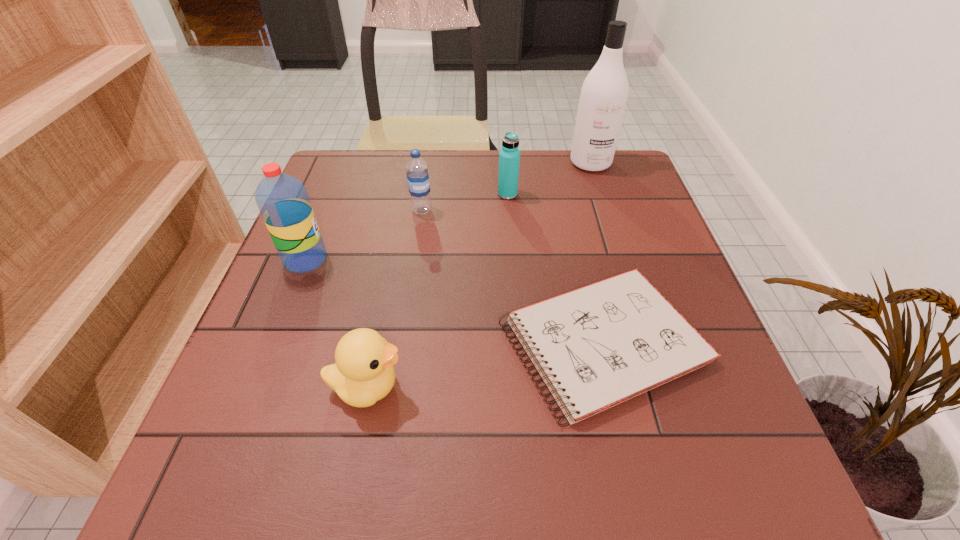
Locate an element on the screen. The height and width of the screenshot is (540, 960). vacant region between the duck and the leftmost object is located at coordinates (336, 323).

Where is `free space between the second water bottle from right to left and the rightmost water bottle`? free space between the second water bottle from right to left and the rightmost water bottle is located at coordinates (465, 202).

Find the location of a particular element. The width and height of the screenshot is (960, 540). vacant point located between the duck and the farthest object is located at coordinates (479, 275).

At what (x,y) coordinates should I click in order to perform the action: click on vacant area that lies between the shampoo and the third nearest object. Please return your answer as a coordinate pair (x, y). The width and height of the screenshot is (960, 540). Looking at the image, I should click on (448, 211).

This screenshot has width=960, height=540. I want to click on free space between the second nearest water bottle and the notepad, so click(x=513, y=276).

You are a GUI agent. You are given a task and a screenshot of the screen. Output one action in this format:
    pyautogui.click(x=<x>, y=<y>)
    Task: Click on the object that stands as the closest to the rightmost water bottle
    
    Given the screenshot: What is the action you would take?
    pyautogui.click(x=417, y=171)

The height and width of the screenshot is (540, 960). I want to click on object that is the fifth closest to the fifth tallest object, so click(x=603, y=98).

The width and height of the screenshot is (960, 540). In order to click on the second closest water bottle to the second nearest water bottle in this screenshot , I will do `click(283, 201)`.

Image resolution: width=960 pixels, height=540 pixels. In order to click on water bottle that is the second closest one to the fourth nearest object in this screenshot , I will do `click(283, 201)`.

Find the location of a particular element. The width and height of the screenshot is (960, 540). free location that satisfies the following two spatial constraints: 1. on the front label of the tallest water bottle; 2. on the right side of the notepad is located at coordinates (273, 342).